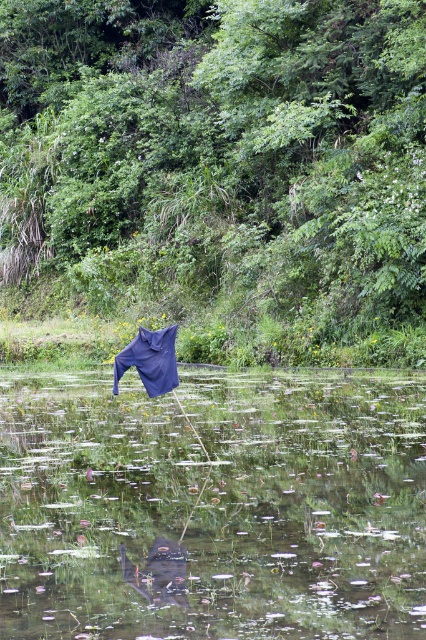
You are standing at the edge of the pond and want to place a small decorative stone exactly where the dark blue fabric at center is located. Since you can only throw the stone to a specific coordinate, what coordinates should you aim for?

You should aim for the coordinates point (221, 170) where the dark blue fabric at center is located.

You are standing near the water and want to place both the dark blue fabric at center and the blue fabric umbrella at center on the same spot. Which one should you choose to fit better if the spot is narrower?

The blue fabric umbrella at center is narrower than the dark blue fabric at center, so it will fit better in the narrower spot.